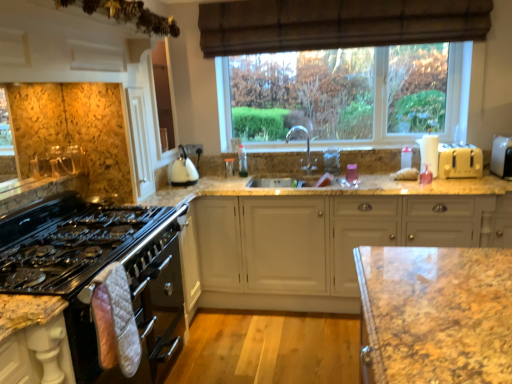
Question: From their relative heights in the image, would you say white plastic toaster at right, which is the 2th appliance in left-to-right order, is taller or shorter than granite countertop at center?

Choices:
 (A) tall
 (B) short

Answer: (A)

Question: Considering the positions of point (493, 172) and point (291, 140), is point (493, 172) closer or farther from the camera than point (291, 140)?

Choices:
 (A) closer
 (B) farther

Answer: (A)

Question: Estimate the real-world distances between objects in this image. Which object is closer to the white matte cabinet at center?

Choices:
 (A) black glass oven at left
 (B) black glass gas stove at left
 (C) pink quilted oven mitt at lower left
 (D) white plastic toaster at right, the first appliance viewed from the left
 (E) granite countertop at center

Answer: (E)

Question: Which of these objects is positioned farthest from the black glass oven at left?

Choices:
 (A) white glossy kettle at upper center
 (B) brown textured curtain at upper center
 (C) white matte cabinet at center
 (D) black glass gas stove at left
 (E) granite countertop at center

Answer: (B)